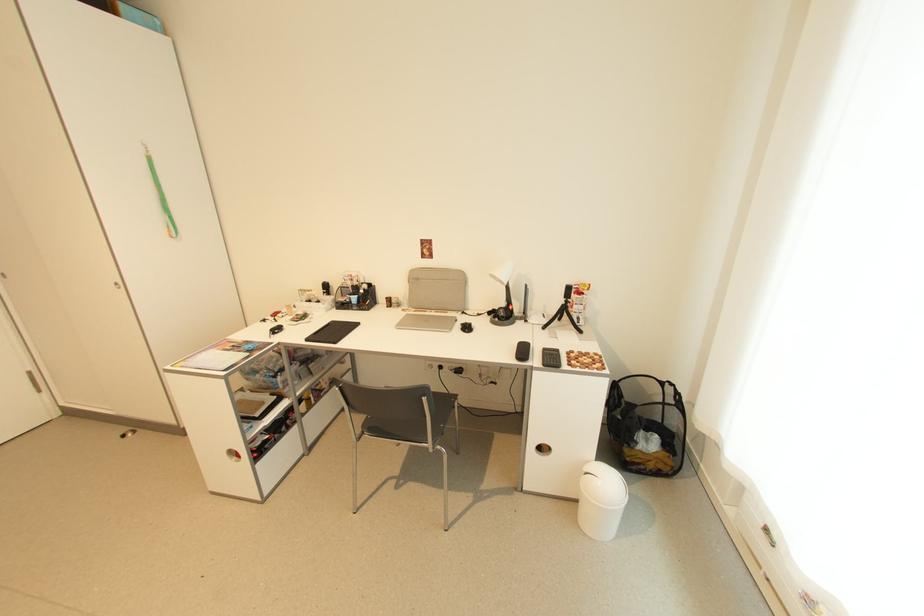
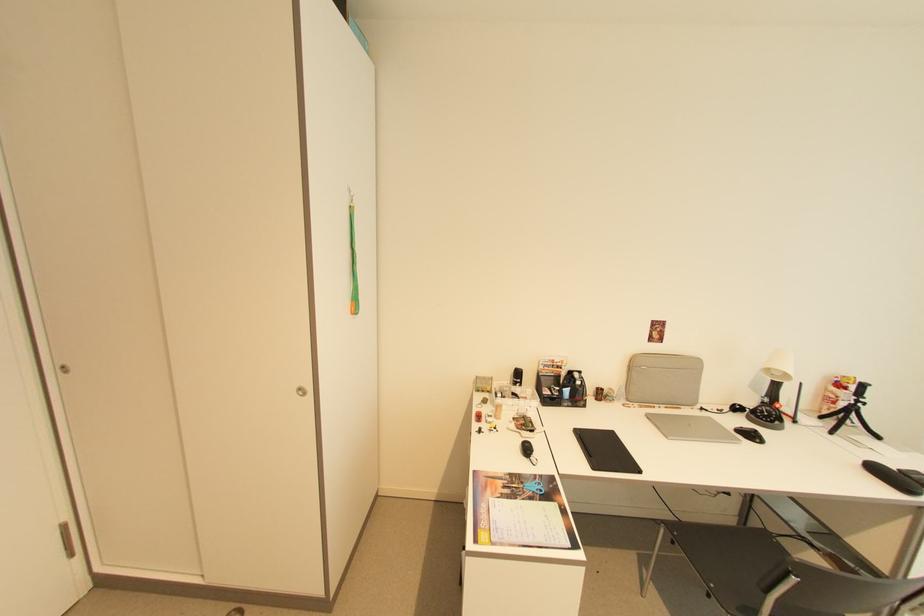
Locate, in the second image, the point that corresponds to [419,280] in the first image.

(638, 366)